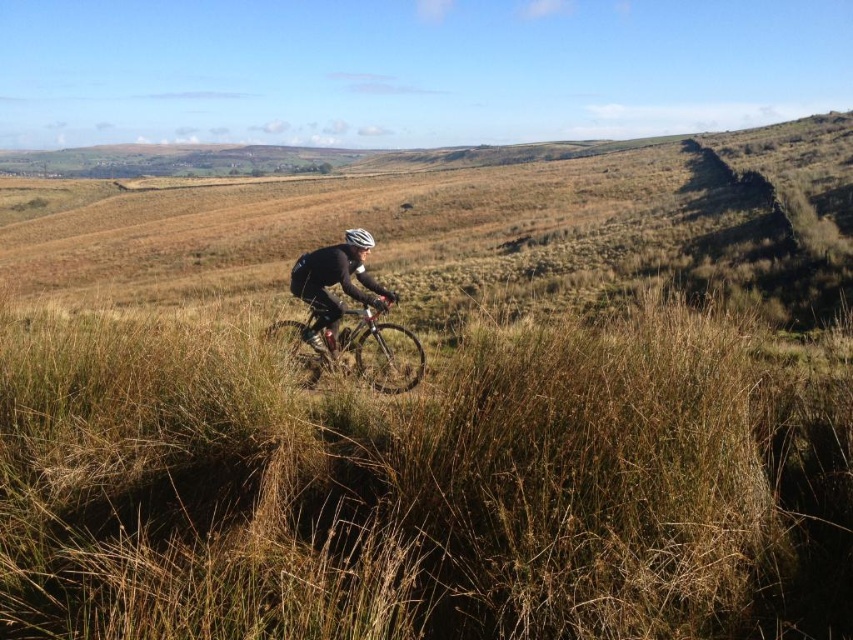
Question: Does silver metallic mountain bike at center appear on the left side of black matte jacket at center?

Choices:
 (A) no
 (B) yes

Answer: (B)

Question: Is silver metallic mountain bike at center in front of black matte jacket at center?

Choices:
 (A) no
 (B) yes

Answer: (B)

Question: Which point is closer to the camera taking this photo?

Choices:
 (A) (347, 228)
 (B) (306, 570)
 (C) (299, 371)
 (D) (318, 296)

Answer: (B)

Question: Which point is closer to the camera taking this photo?

Choices:
 (A) (361, 236)
 (B) (299, 291)
 (C) (419, 353)

Answer: (A)

Question: Which point is closer to the camera?

Choices:
 (A) (337, 445)
 (B) (355, 328)
 (C) (305, 282)
 (D) (360, 237)

Answer: (A)

Question: Does silver metallic mountain bike at center have a greater width compared to white textured helmet at center?

Choices:
 (A) no
 (B) yes

Answer: (A)